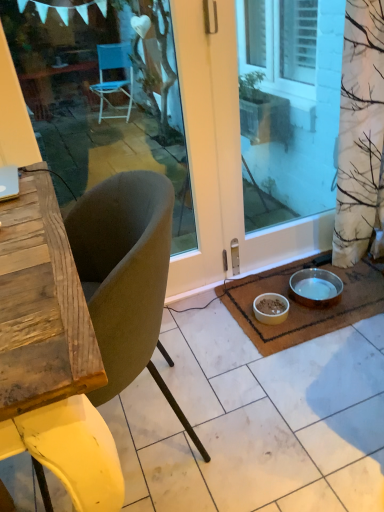
Where is `free point in front of metallic silver bowl at lower right, the first bowl viewed from the right`? This screenshot has width=384, height=512. free point in front of metallic silver bowl at lower right, the first bowl viewed from the right is located at coordinates (320, 323).